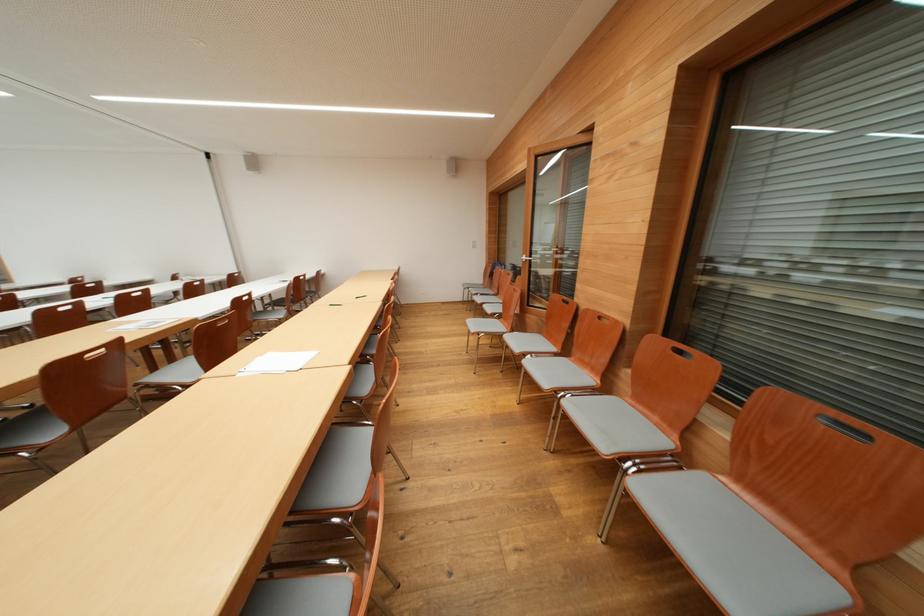
Where would you lift the white paper sheets? Please return your answer as a coordinate pair (x, y).

(276, 362)